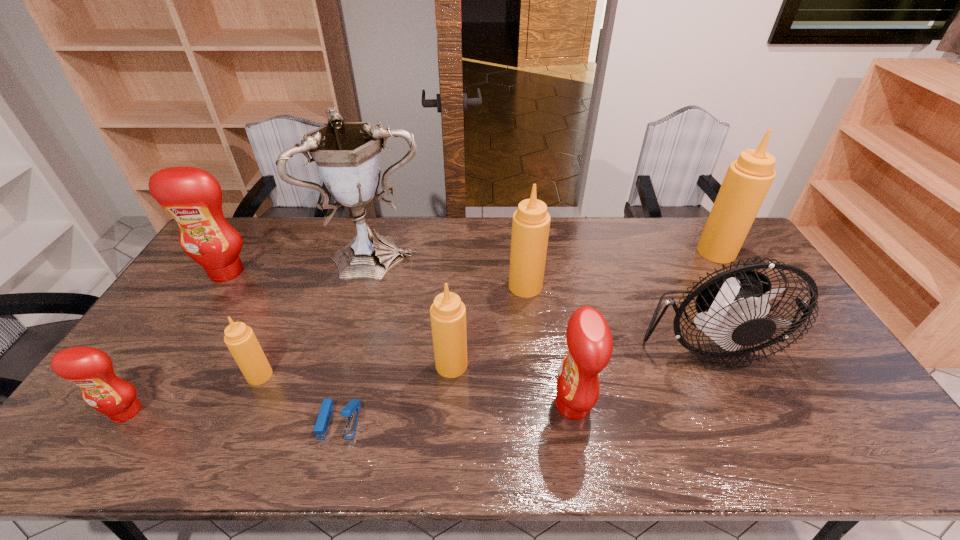
Where is `vacant position located 0.060m on the front of the fourth condiment from right to left`? This screenshot has width=960, height=540. vacant position located 0.060m on the front of the fourth condiment from right to left is located at coordinates (449, 398).

The width and height of the screenshot is (960, 540). Find the location of `free space located on the label side of the rightmost red condiment`. free space located on the label side of the rightmost red condiment is located at coordinates (410, 405).

This screenshot has width=960, height=540. I want to click on vacant space located 0.350m on the label side of the rightmost red condiment, so click(414, 405).

You are a GUI agent. You are given a task and a screenshot of the screen. Output one action in this format:
    pyautogui.click(x=<x>, y=<y>)
    Task: Click on the vacant space situated on the label side of the rightmost red condiment
    
    Given the screenshot: What is the action you would take?
    pyautogui.click(x=394, y=405)

The width and height of the screenshot is (960, 540). Identify the location of vacant space located on the left of the smallest tan condiment. (172, 375).

Locate an element on the screen. Image resolution: width=960 pixels, height=540 pixels. free region located on the left of the blue stapler is located at coordinates (259, 421).

Locate an element on the screen. The width and height of the screenshot is (960, 540). trophy cup present at the far edge is located at coordinates (347, 154).

Where is `condiment present at the far edge`? condiment present at the far edge is located at coordinates (747, 181).

Where is `condiment that is at the near edge`? This screenshot has width=960, height=540. condiment that is at the near edge is located at coordinates (589, 339).

Where is `stapler positioned at the near edge`? The height and width of the screenshot is (540, 960). stapler positioned at the near edge is located at coordinates (351, 410).